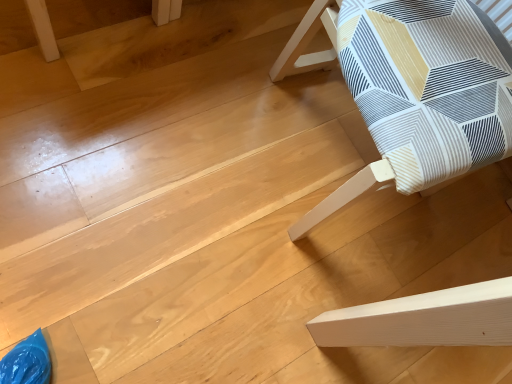
The image size is (512, 384). Find the location of `free space in front of white fabric chair at right, placed as the first furniture when sorted from right to left`. free space in front of white fabric chair at right, placed as the first furniture when sorted from right to left is located at coordinates (228, 244).